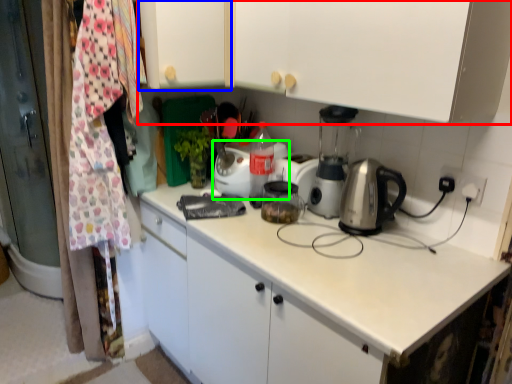
Question: Estimate the real-world distances between objects in this image. Which object is closer to cabinetry (highlighted by a red box), cabinetry (highlighted by a blue box) or kitchen appliance (highlighted by a green box)?

Choices:
 (A) cabinetry
 (B) kitchen appliance

Answer: (A)